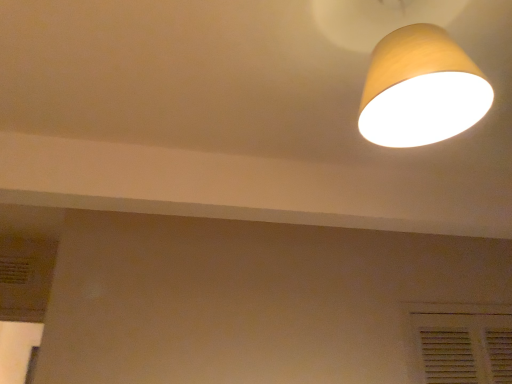
This screenshot has width=512, height=384. What are the coordinates of `beige fabric lampshade at upper right` in the screenshot? It's located at (421, 89).

Measure the distance between beige fabric lampshade at upper right and camera.

The depth of beige fabric lampshade at upper right is 28.94 inches.

What do you see at coordinates (421, 89) in the screenshot? I see `beige fabric lampshade at upper right` at bounding box center [421, 89].

Image resolution: width=512 pixels, height=384 pixels. Identify the location of beige fabric lampshade at upper right. (421, 89).